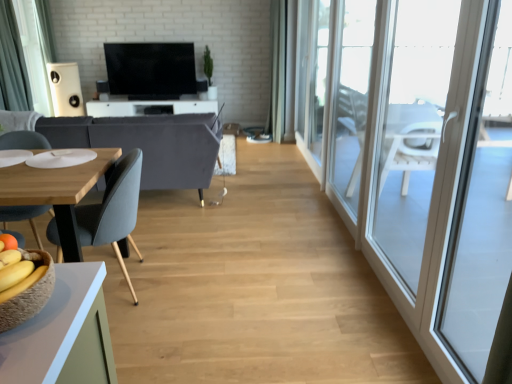
Identify the location of free location to the left of transparent glass screen door at right. (261, 320).